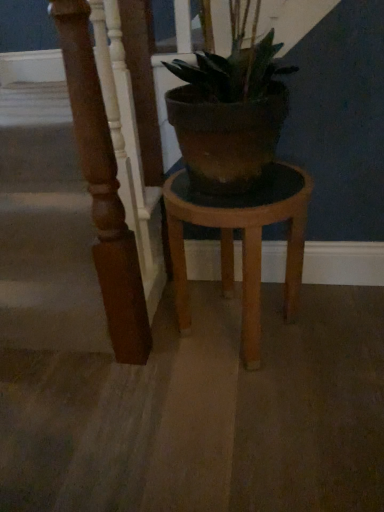
This screenshot has width=384, height=512. Find the location of `vacant region below wooden stool at center (from a real-world perspective)`. vacant region below wooden stool at center (from a real-world perspective) is located at coordinates (230, 330).